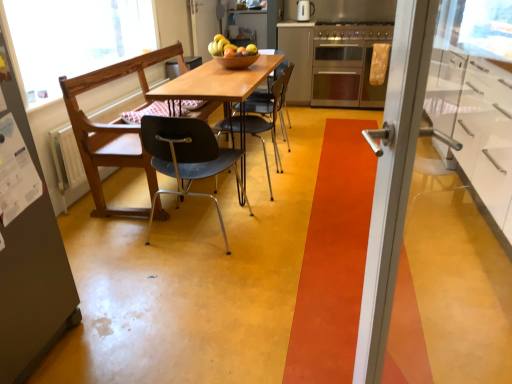
Question: Which direction should I rotate to face wooden chair at center, the second chair in the back-to-front sequence, — up or down?

Choices:
 (A) down
 (B) up

Answer: (B)

Question: Is stainless steel oven at center wider than satin silver cabinet at center, which appears as the first cabinetry when viewed from the back?

Choices:
 (A) no
 (B) yes

Answer: (A)

Question: Is stainless steel oven at center shorter than satin silver cabinet at center, acting as the 2th cabinetry starting from the bottom?

Choices:
 (A) yes
 (B) no

Answer: (A)

Question: From a real-world perspective, is stainless steel oven at center over satin silver cabinet at center, the 2th cabinetry when ordered from front to back?

Choices:
 (A) no
 (B) yes

Answer: (A)

Question: Considering the relative sizes of stainless steel oven at center and satin silver cabinet at center, the 2th cabinetry when ordered from front to back, in the image provided, is stainless steel oven at center bigger than satin silver cabinet at center, the 2th cabinetry when ordered from front to back,?

Choices:
 (A) no
 (B) yes

Answer: (B)

Question: Does stainless steel oven at center appear on the left side of satin silver cabinet at center, the second cabinetry positioned from the right?

Choices:
 (A) no
 (B) yes

Answer: (A)

Question: Considering the relative sizes of stainless steel oven at center and satin silver cabinet at center, the first cabinetry when ordered from left to right, in the image provided, is stainless steel oven at center smaller than satin silver cabinet at center, the first cabinetry when ordered from left to right,?

Choices:
 (A) no
 (B) yes

Answer: (A)

Question: Is shiny brown bowl at center directly adjacent to matte black chair at center, the first chair positioned from the front?

Choices:
 (A) yes
 (B) no

Answer: (B)

Question: Can you confirm if shiny brown bowl at center is taller than matte black chair at center, positioned as the third chair in back-to-front order?

Choices:
 (A) yes
 (B) no

Answer: (B)

Question: Considering the relative sizes of shiny brown bowl at center and matte black chair at center, positioned as the third chair in back-to-front order, in the image provided, is shiny brown bowl at center bigger than matte black chair at center, positioned as the third chair in back-to-front order,?

Choices:
 (A) no
 (B) yes

Answer: (A)

Question: Considering the relative sizes of shiny brown bowl at center and matte black chair at center, positioned as the third chair in back-to-front order, in the image provided, is shiny brown bowl at center wider than matte black chair at center, positioned as the third chair in back-to-front order,?

Choices:
 (A) no
 (B) yes

Answer: (A)

Question: Is shiny brown bowl at center shorter than matte black chair at center, positioned as the third chair in back-to-front order?

Choices:
 (A) no
 (B) yes

Answer: (B)

Question: From the image's perspective, would you say shiny brown bowl at center is shown under matte black chair at center, the first chair positioned from the front?

Choices:
 (A) no
 (B) yes

Answer: (A)

Question: Can you confirm if wooden chair at center, the 2th chair when ordered from front to back, is wider than matte black chair at center, the first chair positioned from the front?

Choices:
 (A) no
 (B) yes

Answer: (A)